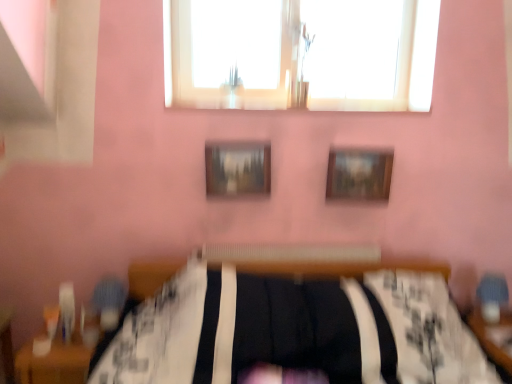
Question: In terms of size, does wooden table at lower right, placed as the 1th table when sorted from right to left, appear bigger or smaller than wooden table at lower left, positioned as the 2th table in right-to-left order?

Choices:
 (A) small
 (B) big

Answer: (B)

Question: Considering the relative positions of wooden table at lower right, placed as the 1th table when sorted from right to left, and wooden table at lower left, positioned as the 1th table in left-to-right order, in the image provided, is wooden table at lower right, placed as the 1th table when sorted from right to left, to the left or to the right of wooden table at lower left, positioned as the 1th table in left-to-right order,?

Choices:
 (A) left
 (B) right

Answer: (B)

Question: Estimate the real-world distances between objects in this image. Which object is farther from the wooden picture frame at upper center, the second picture frame when ordered from left to right?

Choices:
 (A) transparent glass window at upper center
 (B) wooden table at lower right, the 2th table from the left
 (C) wooden table at lower left, positioned as the 1th table in left-to-right order
 (D) wooden textured picture frame at center, acting as the second picture frame starting from the right

Answer: (C)

Question: Which is farther from the wooden picture frame at upper center, the second picture frame when ordered from left to right?

Choices:
 (A) wooden table at lower left, positioned as the 1th table in left-to-right order
 (B) transparent glass window at upper center
 (C) wooden table at lower right, the 2th table from the left
 (D) wooden textured picture frame at center, positioned as the first picture frame in left-to-right order

Answer: (A)